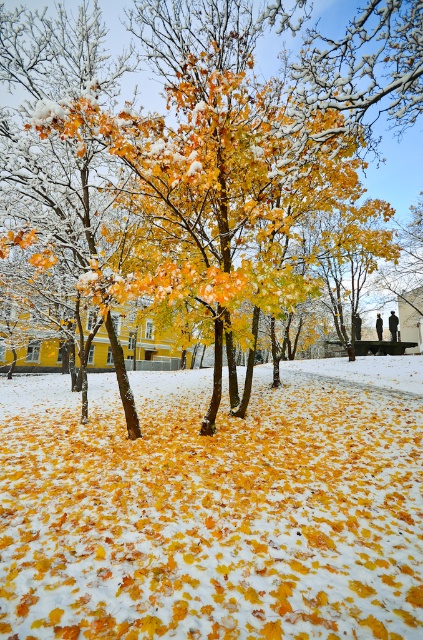
The height and width of the screenshot is (640, 423). Find the location of `yellow matte leaves at center`. yellow matte leaves at center is located at coordinates (214, 506).

Is yellow matte leaves at center shorter than yellow matte tree at center?

Yes, yellow matte leaves at center is shorter than yellow matte tree at center.

Image resolution: width=423 pixels, height=640 pixels. What are the coordinates of `yellow matte leaves at center` in the screenshot? It's located at (214, 506).